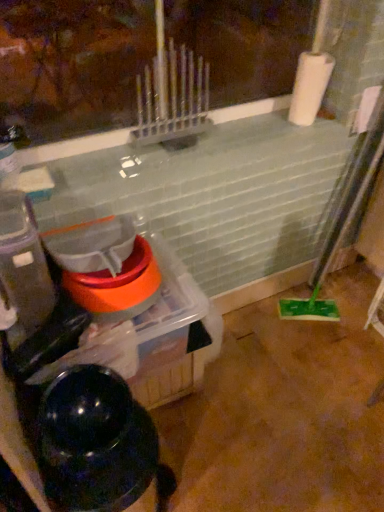
Question: From a real-world perspective, does black glossy water heater at lower left sit lower than translucent plastic container at left?

Choices:
 (A) yes
 (B) no

Answer: (A)

Question: Is black glossy water heater at lower left positioned behind translucent plastic container at left?

Choices:
 (A) yes
 (B) no

Answer: (B)

Question: Is black glossy water heater at lower left bigger than translucent plastic container at left?

Choices:
 (A) yes
 (B) no

Answer: (A)

Question: Does black glossy water heater at lower left appear on the left side of translucent plastic container at left?

Choices:
 (A) no
 (B) yes

Answer: (A)

Question: Is black glossy water heater at lower left taller than translucent plastic container at left?

Choices:
 (A) yes
 (B) no

Answer: (A)

Question: Considering the positions of translucent plastic container at left and black glossy water heater at lower left in the image, is translucent plastic container at left wider or thinner than black glossy water heater at lower left?

Choices:
 (A) thin
 (B) wide

Answer: (A)

Question: In terms of height, does translucent plastic container at left look taller or shorter compared to black glossy water heater at lower left?

Choices:
 (A) tall
 (B) short

Answer: (B)

Question: Which is correct: translucent plastic container at left is inside black glossy water heater at lower left, or outside of it?

Choices:
 (A) outside
 (B) inside

Answer: (A)

Question: Is translucent plastic container at left to the left or to the right of black glossy water heater at lower left in the image?

Choices:
 (A) left
 (B) right

Answer: (A)

Question: Relative to white matte paper towel at upper right, is black glossy water heater at lower left in front or behind?

Choices:
 (A) behind
 (B) front

Answer: (B)

Question: From a real-world perspective, is black glossy water heater at lower left physically located above or below white matte paper towel at upper right?

Choices:
 (A) above
 (B) below

Answer: (B)

Question: From the image's perspective, is black glossy water heater at lower left positioned above or below white matte paper towel at upper right?

Choices:
 (A) above
 (B) below

Answer: (B)

Question: Considering the relative positions of black glossy water heater at lower left and white matte paper towel at upper right in the image provided, is black glossy water heater at lower left to the left or to the right of white matte paper towel at upper right?

Choices:
 (A) right
 (B) left

Answer: (B)

Question: From the image's perspective, is black glossy water heater at lower left positioned above or below translucent plastic container at left?

Choices:
 (A) below
 (B) above

Answer: (A)

Question: Considering their positions, is black glossy water heater at lower left located in front of or behind translucent plastic container at left?

Choices:
 (A) behind
 (B) front

Answer: (B)